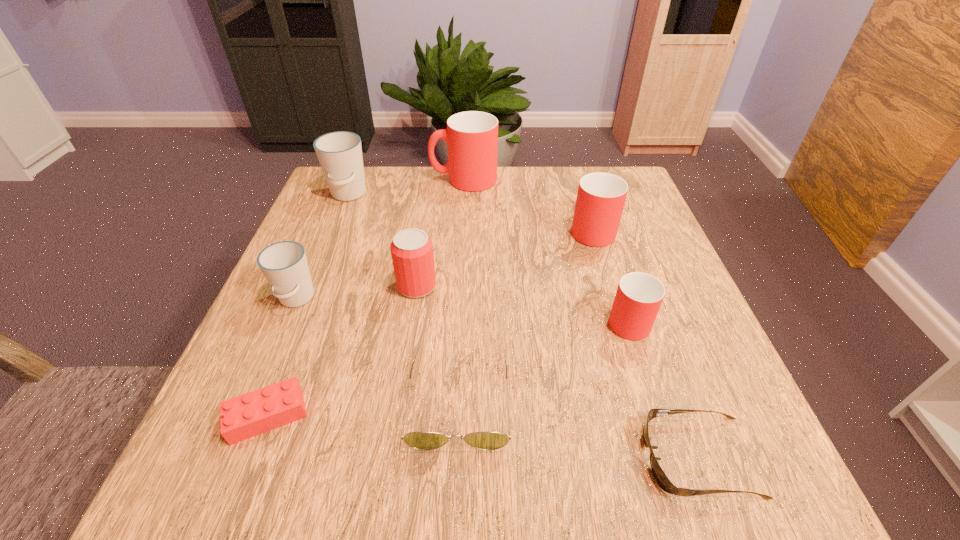
In the image, there is a desktop. Find the location of `vacant space at the far left corner`. vacant space at the far left corner is located at coordinates [x=324, y=208].

Locate an element on the screen. vacant area between the farther white cup and the second biggest red cup is located at coordinates (469, 212).

Where is `vacant area between the farther white cup and the smaller white cup`? vacant area between the farther white cup and the smaller white cup is located at coordinates (322, 247).

You are a GUI agent. You are given a task and a screenshot of the screen. Output one action in this format:
    pyautogui.click(x=<x>, y=<y>)
    Task: Click on the free space between the red beer can and the nearest red cup
    
    Given the screenshot: What is the action you would take?
    pyautogui.click(x=522, y=302)

At what (x,y) coordinates should I click in order to perform the action: click on free spot between the green sunglasses and the red Lego. Please return your answer as a coordinate pair (x, y). Looking at the image, I should click on (363, 410).

Find the location of a particular element. This screenshot has width=960, height=540. empty location between the shorter sunglasses and the second nearest red cup is located at coordinates (645, 343).

Locate an element on the screen. free space between the smallest red cup and the farther white cup is located at coordinates (488, 257).

Locate an element on the screen. This screenshot has height=540, width=960. free space between the beer can and the second biggest red cup is located at coordinates (504, 257).

Where is `unoccupied area between the smallest red cup and the beer can`? This screenshot has width=960, height=540. unoccupied area between the smallest red cup and the beer can is located at coordinates (522, 302).

At what (x,y) coordinates should I click in order to perform the action: click on unoccupied area between the red Lego and the smaller white cup. Please return your answer as a coordinate pair (x, y). This screenshot has height=540, width=960. Looking at the image, I should click on [282, 357].